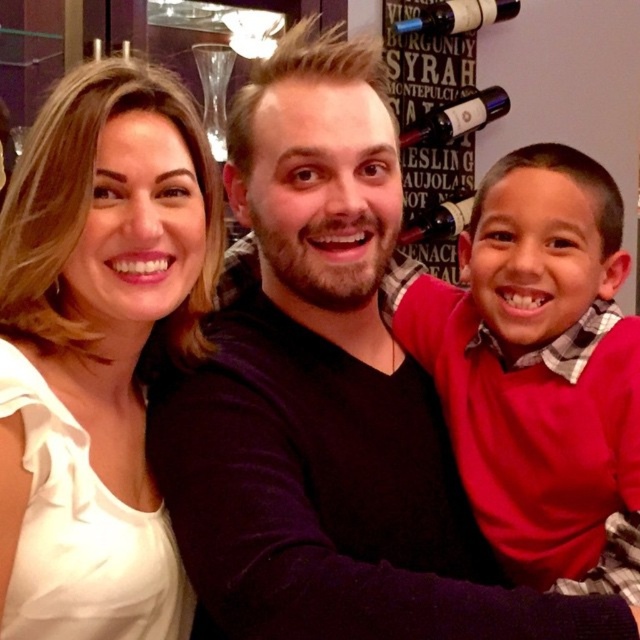
You are standing in the dining area and want to place a red matte sweater at the point with coordinates (534, 360). The sweater is 1.2 meters wide. Is there enough space at that location?

The red matte sweater at right is located at point (534, 360). Since the sweater is 1.2 meters wide, you need to ensure the space at that coordinate can accommodate its width. However, without knowing the available space dimensions, it is impossible to determine if there is enough room. Please check the area dimensions before placing the sweater.

You are a server at a restaurant and need to place a 12.5 inch wide decorative plate between the matte glass wine bottle at upper right and the clear glass wine glass at upper center. Can you fit it there?

The distance between the matte glass wine bottle at upper right and the clear glass wine glass at upper center is 31.61 inches. Since the plate is only 12.5 inches wide, there is enough space to place it between them.